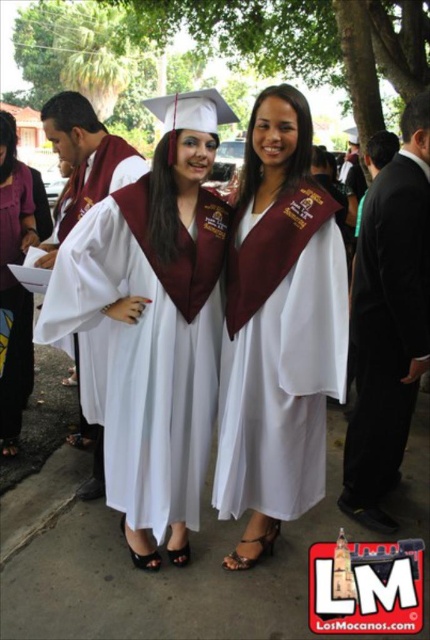
Question: Is white matte graduation gown at center smaller than white satin gown at center?

Choices:
 (A) yes
 (B) no

Answer: (B)

Question: From the image, what is the correct spatial relationship of black suit at right in relation to matte white gown at center?

Choices:
 (A) left
 (B) right

Answer: (B)

Question: Is maroon satin graduation gown at left positioned in front of matte white gown at center?

Choices:
 (A) no
 (B) yes

Answer: (B)

Question: Which point is farther to the camera?

Choices:
 (A) (390, 392)
 (B) (92, 211)

Answer: (A)

Question: Which point is closer to the camera?

Choices:
 (A) (6, 360)
 (B) (60, 227)
 (C) (157, 321)

Answer: (C)

Question: Which point appears closest to the camera in this image?

Choices:
 (A) (393, 166)
 (B) (123, 262)

Answer: (B)